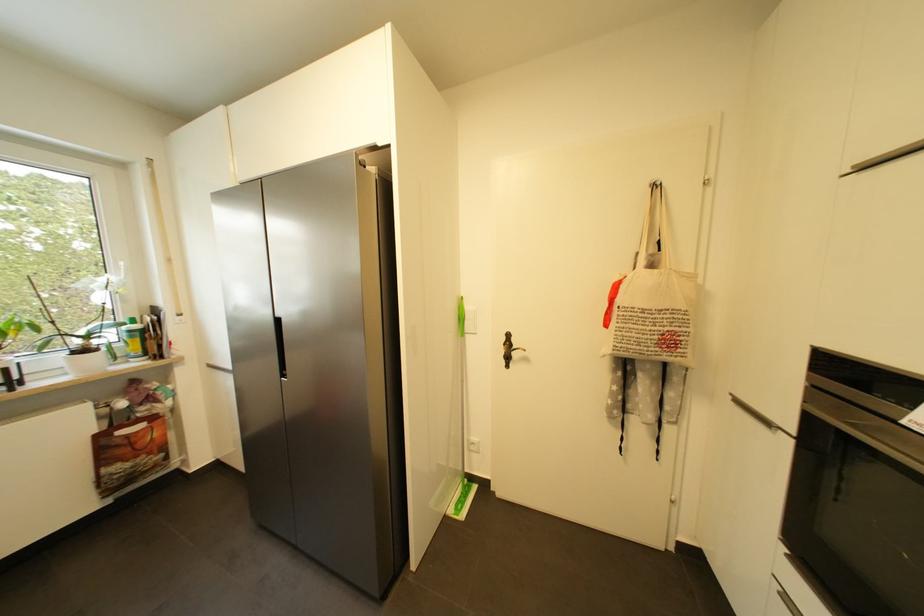
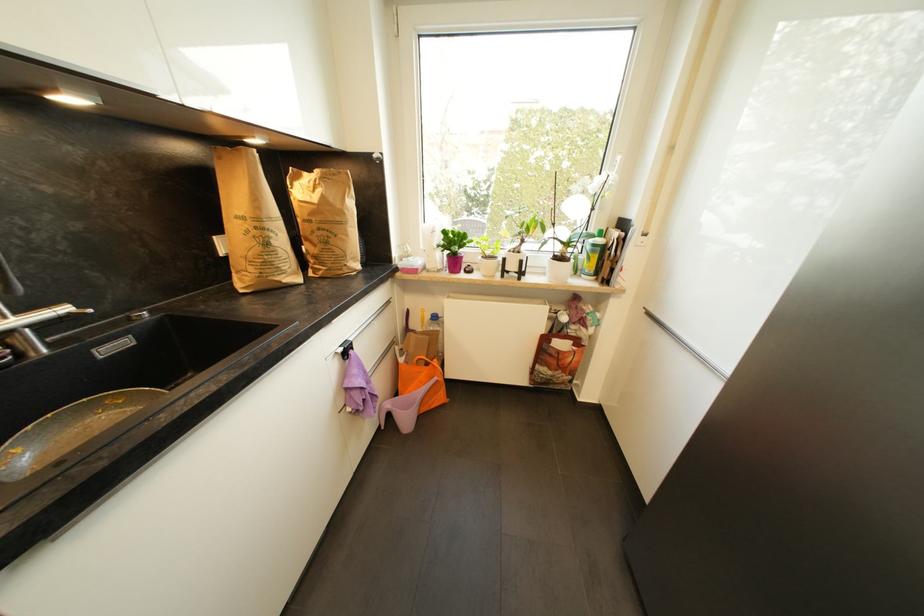
Based on the photo, the first image is from the beginning of the video and the second image is from the end. How did the camera likely rotate when shooting the video?

The camera's rotation is toward left-down.